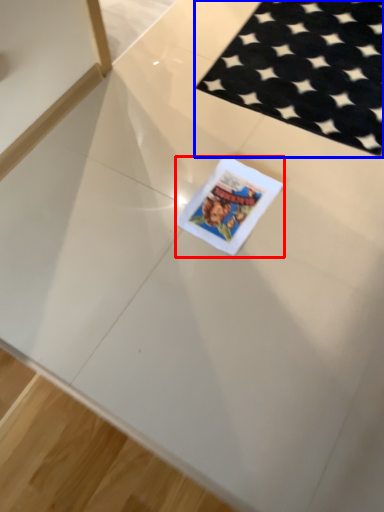
Question: Among these objects, which one is nearest to the camera, birthday card (highlighted by a red box) or mat (highlighted by a blue box)?

Choices:
 (A) birthday card
 (B) mat

Answer: (A)